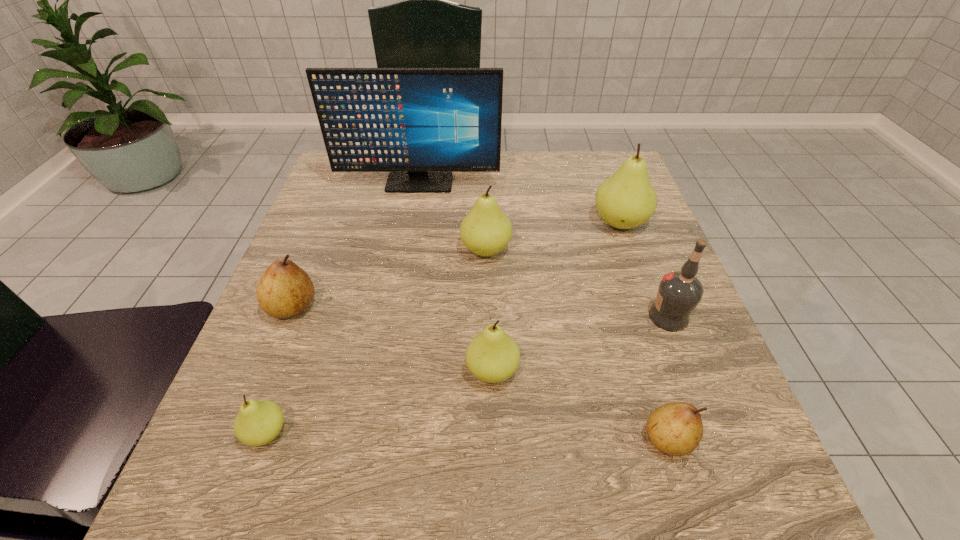
At what (x,y) coordinates should I click in order to perform the action: click on vacant area at the far edge of the desktop. Please return your answer as a coordinate pair (x, y). The height and width of the screenshot is (540, 960). Looking at the image, I should click on (571, 183).

Find the location of a particular element. blank area at the near edge is located at coordinates (487, 519).

Image resolution: width=960 pixels, height=540 pixels. Find the location of `blank space at the left edge of the desktop`. blank space at the left edge of the desktop is located at coordinates (332, 226).

You are a GUI agent. You are given a task and a screenshot of the screen. Output one action in this format:
    pyautogui.click(x=<x>, y=<y>)
    Task: Click on the vacant space at the right edge of the desktop
    The width and height of the screenshot is (960, 540).
    Given the screenshot: What is the action you would take?
    pyautogui.click(x=588, y=220)

In the image, there is a desktop. Where is `vacant space at the near left corner`? vacant space at the near left corner is located at coordinates (180, 494).

Identify the location of vacant region at the far right corner. (597, 186).

Locate an element on the screen. This screenshot has height=540, width=960. vacant area that lies between the nearer brown pear and the fifth shortest pear is located at coordinates (577, 345).

Find the location of `vacant area that lies between the second smallest green pear and the biggest green pear`. vacant area that lies between the second smallest green pear and the biggest green pear is located at coordinates (556, 297).

Where is `free space that is in between the left brown pear and the nearest green pear`? free space that is in between the left brown pear and the nearest green pear is located at coordinates (279, 370).

Identify the location of free space between the nearer brown pear and the computer monitor. Image resolution: width=960 pixels, height=540 pixels. (543, 311).